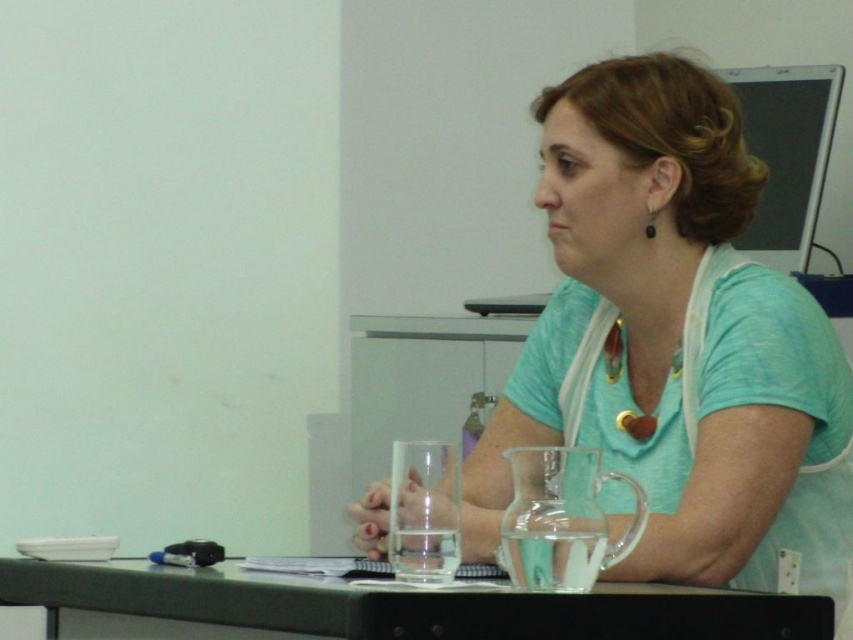
Question: Which of the following is the closest to the observer?

Choices:
 (A) matte teal shirt at center
 (B) black plastic table at lower center

Answer: (B)

Question: Which of the following is the farthest from the observer?

Choices:
 (A) matte teal shirt at center
 (B) black plastic table at lower center

Answer: (A)

Question: Which point is farther to the camera?

Choices:
 (A) (811, 356)
 (B) (677, 630)

Answer: (A)

Question: Does matte teal shirt at center appear under black plastic table at lower center?

Choices:
 (A) yes
 (B) no

Answer: (B)

Question: Is matte teal shirt at center below black plastic table at lower center?

Choices:
 (A) yes
 (B) no

Answer: (B)

Question: Is matte teal shirt at center to the right of black plastic table at lower center from the viewer's perspective?

Choices:
 (A) yes
 (B) no

Answer: (A)